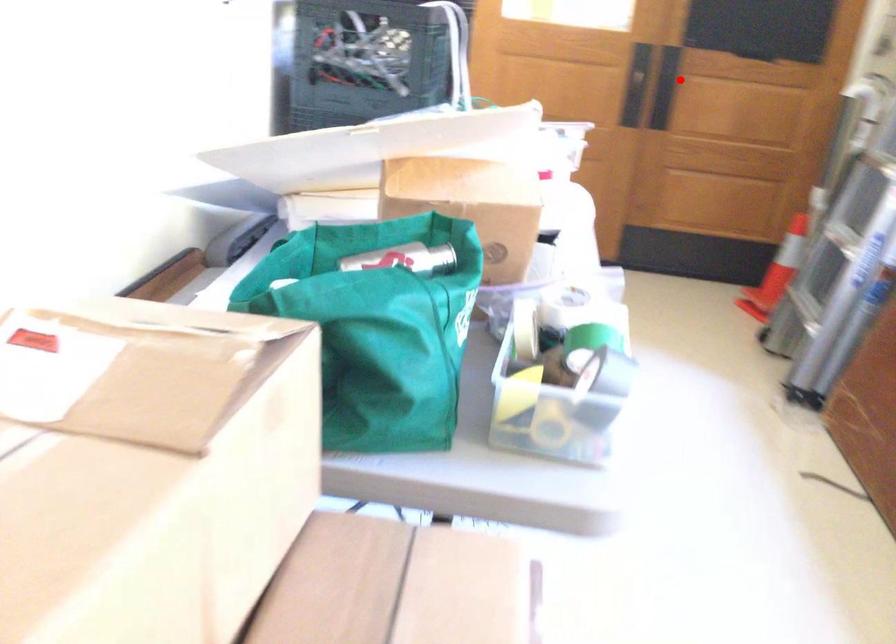
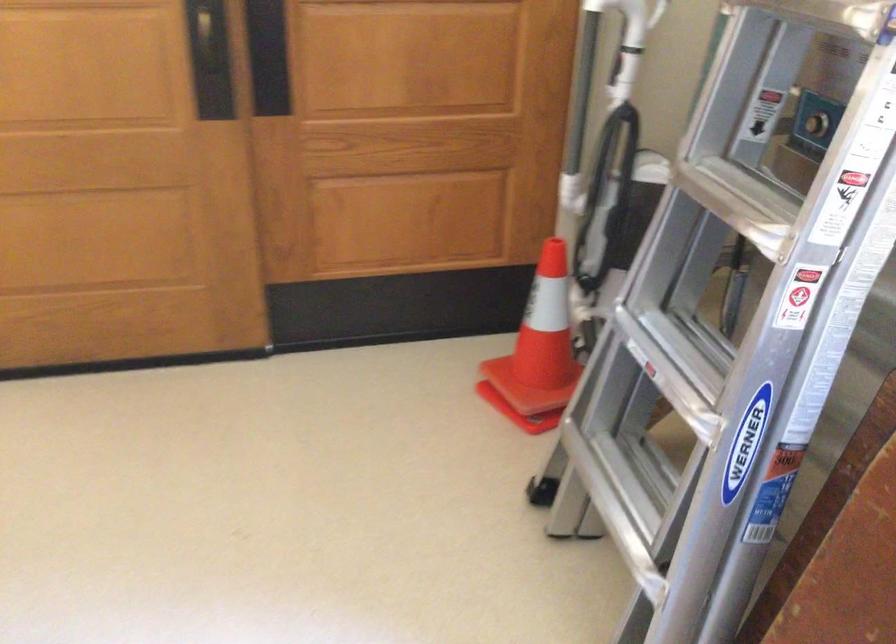
In the second image, find the point that corresponds to the highlighted location in the first image.

(268, 51)